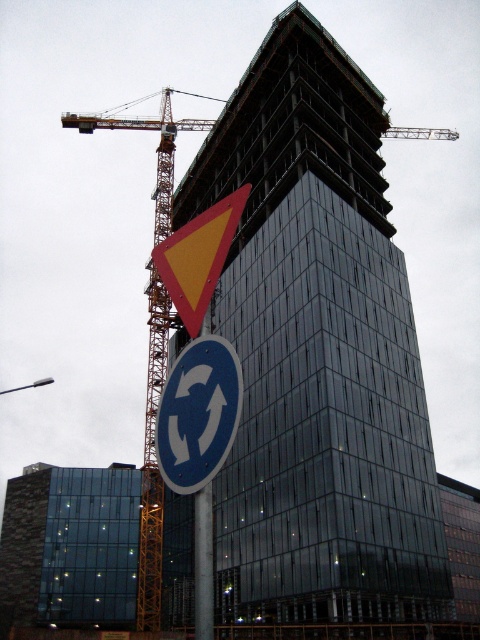
You are a construction worker standing at the base of the yellowmetalliccrane at left. You need to move to the glassy steel tower at center. Which direction should you walk to reach it?

The glassy steel tower at center is to the right of the yellowmetalliccrane at left. So you should walk to the right to reach it.

You are a delivery drone with a maximum flight altitude of 20 meters. You need to fly from the yellowmetalliccrane at left to the glassy steel tower at center. Can you safely make this journey without exceeding your altitude limit?

The glassy steel tower at center and yellowmetalliccrane at left are 19.85 meters apart. Since the distance between them is less than the drone s maximum flight altitude of 20 meters, the drone can safely make the journey without exceeding its altitude limit.